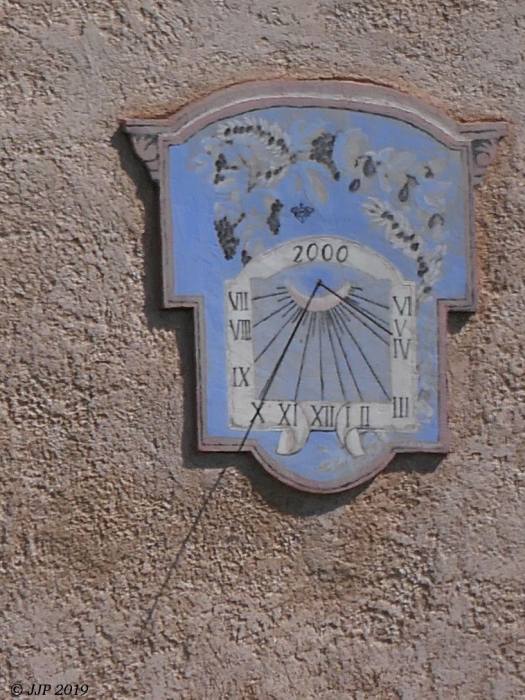
At what (x,y) coordinates should I click in order to perform the action: click on plaque. Please return your answer as a coordinate pair (x, y). Looking at the image, I should click on (333, 204).